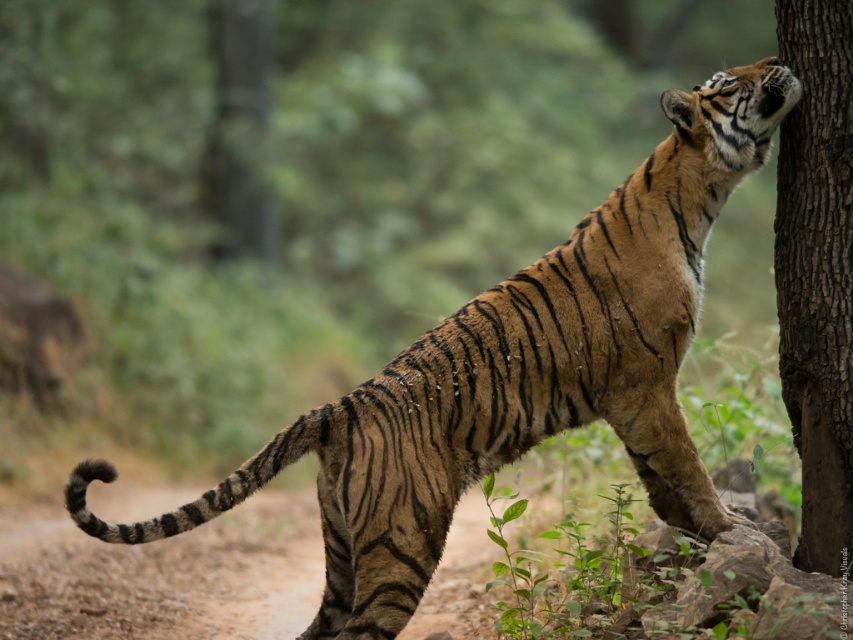
Is point (88, 604) farther from viewer compared to point (837, 385)?

Yes, point (88, 604) is behind point (837, 385).

Between brown dirt track at lower center and brown rough tree trunk at right, which one is positioned lower?

Positioned lower is brown dirt track at lower center.

Image resolution: width=853 pixels, height=640 pixels. I want to click on brown dirt track at lower center, so click(x=164, y=576).

The height and width of the screenshot is (640, 853). Find the location of `brown dirt track at lower center`. brown dirt track at lower center is located at coordinates coord(164,576).